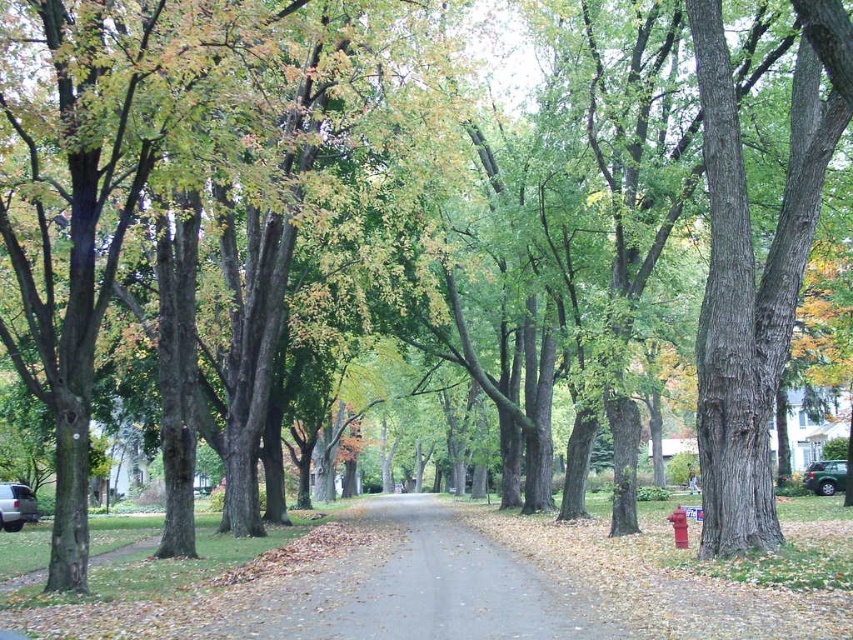
Question: Which object is positioned farthest from the green matte car at lower right?

Choices:
 (A) brown gravel alley at center
 (B) silver metallic suv at left
 (C) red matte fire hydrant at lower right

Answer: (B)

Question: Can you confirm if brown gravel alley at center is smaller than green matte car at lower right?

Choices:
 (A) yes
 (B) no

Answer: (B)

Question: Does brown gravel alley at center appear over green matte car at lower right?

Choices:
 (A) no
 (B) yes

Answer: (B)

Question: Which object is the farthest from the green matte car at lower right?

Choices:
 (A) silver metallic suv at left
 (B) red matte fire hydrant at lower right
 (C) brown gravel alley at center

Answer: (A)

Question: Is silver metallic suv at left to the left of green matte car at lower right from the viewer's perspective?

Choices:
 (A) no
 (B) yes

Answer: (B)

Question: Which object appears closest to the camera in this image?

Choices:
 (A) red matte fire hydrant at lower right
 (B) green matte car at lower right
 (C) silver metallic suv at left

Answer: (A)